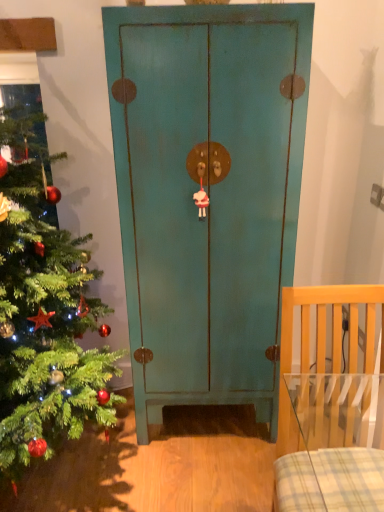
The width and height of the screenshot is (384, 512). I want to click on free point in front of teal matte cabinet at center, so click(203, 476).